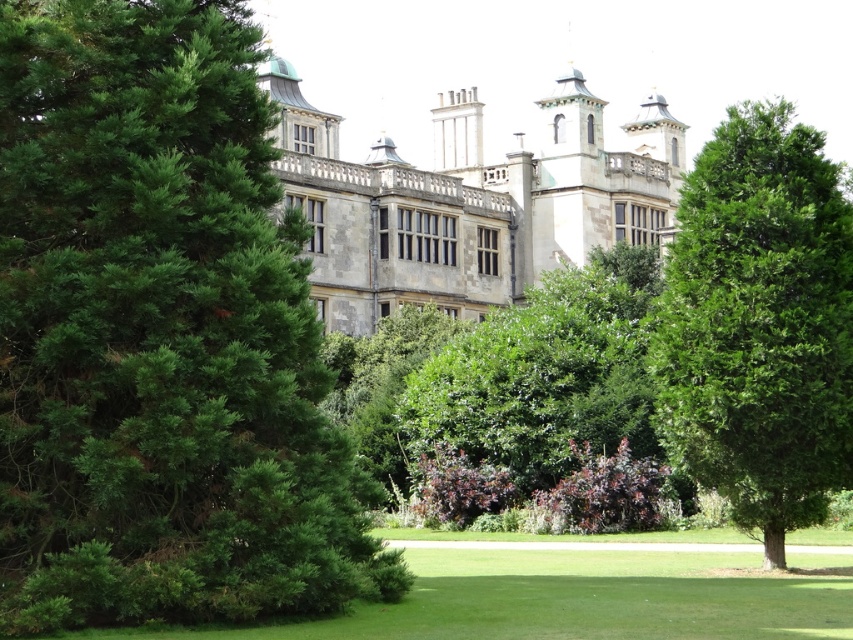
Question: From the image, what is the correct spatial relationship of green leafy bush at center in relation to green leafy bush at lower left?

Choices:
 (A) right
 (B) left

Answer: (A)

Question: Can you confirm if green leafy bush at center is positioned above green leafy bush at lower left?

Choices:
 (A) yes
 (B) no

Answer: (A)

Question: Considering the real-world distances, which object is farthest from the green leafy bush at lower left?

Choices:
 (A) green leafy bush at center
 (B) green leafy tree at center

Answer: (A)

Question: Which point appears closest to the camera in this image?

Choices:
 (A) (554, 552)
 (B) (489, 492)

Answer: (A)

Question: Does green leafy tree at center come behind green leafy bush at center?

Choices:
 (A) no
 (B) yes

Answer: (A)

Question: Which point is farther from the camera taking this photo?

Choices:
 (A) (254, 538)
 (B) (479, 625)

Answer: (A)